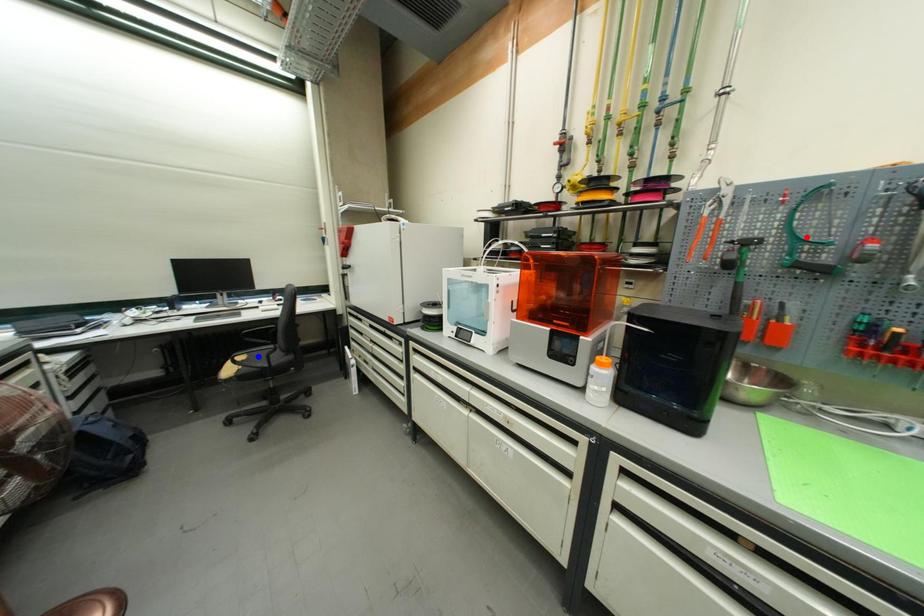
Question: Which of the two points in the image is closer to the camera?

Choices:
 (A) Blue point is closer.
 (B) Red point is closer.

Answer: (B)